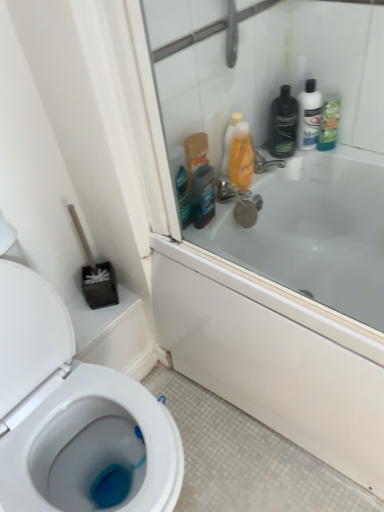
Question: Does dark brown plastic mouthwash at upper right come in front of translucent orange bottle at upper right, the second cleaning product viewed from the right?

Choices:
 (A) no
 (B) yes

Answer: (B)

Question: Is dark brown plastic mouthwash at upper right looking in the opposite direction of translucent orange bottle at upper right, the second cleaning product viewed from the right?

Choices:
 (A) yes
 (B) no

Answer: (B)

Question: Is dark brown plastic mouthwash at upper right not inside translucent orange bottle at upper right, the 1th cleaning product in the left-to-right sequence?

Choices:
 (A) yes
 (B) no

Answer: (A)

Question: Considering the relative positions of dark brown plastic mouthwash at upper right and translucent orange bottle at upper right, the 1th cleaning product in the left-to-right sequence, in the image provided, is dark brown plastic mouthwash at upper right behind translucent orange bottle at upper right, the 1th cleaning product in the left-to-right sequence,?

Choices:
 (A) yes
 (B) no

Answer: (B)

Question: From a real-world perspective, is dark brown plastic mouthwash at upper right positioned over translucent orange bottle at upper right, the 1th cleaning product in the left-to-right sequence, based on gravity?

Choices:
 (A) no
 (B) yes

Answer: (A)

Question: Is point 236,155 positioned closer to the camera than point 269,159?

Choices:
 (A) farther
 (B) closer

Answer: (B)

Question: Considering the relative positions of translucent orange bottle at upper right, the second cleaning product viewed from the right, and metallic silver faucet at upper right in the image provided, is translucent orange bottle at upper right, the second cleaning product viewed from the right, to the left or to the right of metallic silver faucet at upper right?

Choices:
 (A) left
 (B) right

Answer: (A)

Question: Considering the positions of translucent orange bottle at upper right, the 1th cleaning product in the left-to-right sequence, and metallic silver faucet at upper right in the image, is translucent orange bottle at upper right, the 1th cleaning product in the left-to-right sequence, bigger or smaller than metallic silver faucet at upper right?

Choices:
 (A) big
 (B) small

Answer: (A)

Question: In terms of height, does translucent orange bottle at upper right, the second cleaning product viewed from the right, look taller or shorter compared to metallic silver faucet at upper right?

Choices:
 (A) short
 (B) tall

Answer: (B)

Question: From a real-world perspective, is metallic silver faucet at upper right physically located above or below green matte bottle at upper right, which is counted as the first cleaning product, starting from the right?

Choices:
 (A) above
 (B) below

Answer: (B)

Question: Considering their positions, is metallic silver faucet at upper right located in front of or behind green matte bottle at upper right, which is counted as the second cleaning product, starting from the left?

Choices:
 (A) front
 (B) behind

Answer: (B)

Question: In terms of height, does metallic silver faucet at upper right look taller or shorter compared to green matte bottle at upper right, which is counted as the second cleaning product, starting from the left?

Choices:
 (A) tall
 (B) short

Answer: (B)

Question: Does point (264, 164) appear closer or farther from the camera than point (331, 99)?

Choices:
 (A) closer
 (B) farther

Answer: (B)

Question: Is transparent glass screen door at upper right in front of or behind dark brown plastic mouthwash at upper right in the image?

Choices:
 (A) front
 (B) behind

Answer: (A)

Question: From a real-world perspective, relative to dark brown plastic mouthwash at upper right, is transparent glass screen door at upper right vertically above or below?

Choices:
 (A) above
 (B) below

Answer: (A)